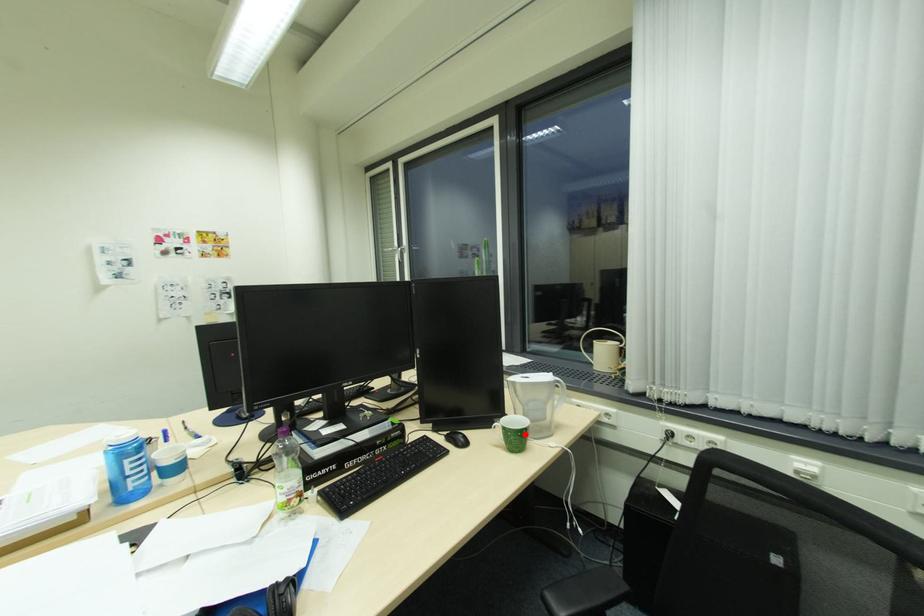
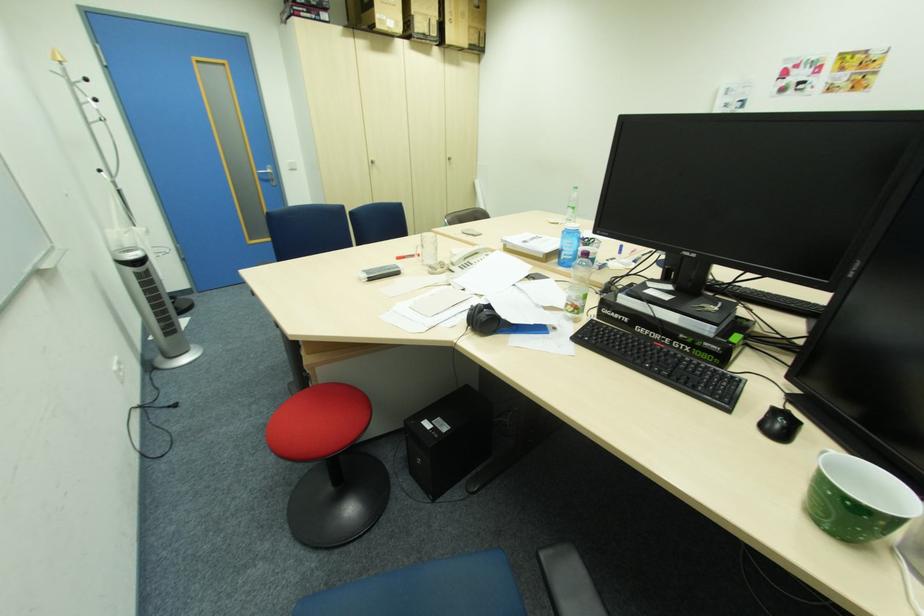
Find the pixel in the second image that matches the highlighted location in the first image.

(833, 492)